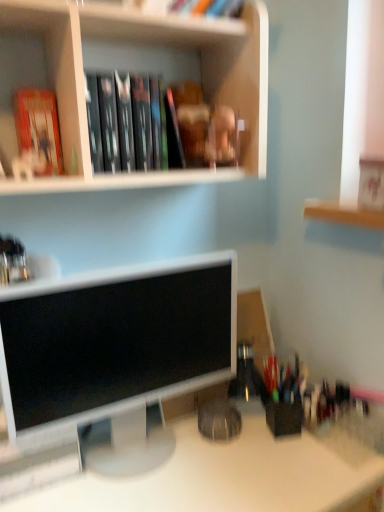
Question: Is hardcover books at upper center smaller than matte white monitor at center?

Choices:
 (A) yes
 (B) no

Answer: (A)

Question: Does hardcover books at upper center appear on the left side of matte white monitor at center?

Choices:
 (A) no
 (B) yes

Answer: (A)

Question: Is hardcover books at upper center positioned before matte white monitor at center?

Choices:
 (A) yes
 (B) no

Answer: (B)

Question: Is hardcover books at upper center outside matte white monitor at center?

Choices:
 (A) yes
 (B) no

Answer: (A)

Question: Is hardcover books at upper center behind matte white monitor at center?

Choices:
 (A) no
 (B) yes

Answer: (B)

Question: From the image's perspective, is hardcover books at upper center above or below matte white monitor at center?

Choices:
 (A) below
 (B) above

Answer: (B)

Question: Does point (122, 114) appear closer or farther from the camera than point (195, 334)?

Choices:
 (A) closer
 (B) farther

Answer: (A)

Question: From their relative heights in the image, would you say hardcover books at upper center is taller or shorter than matte white monitor at center?

Choices:
 (A) tall
 (B) short

Answer: (B)

Question: Do you think hardcover books at upper center is within matte white monitor at center, or outside of it?

Choices:
 (A) outside
 (B) inside

Answer: (A)

Question: From their relative heights in the image, would you say white matte bookshelf at upper center is taller or shorter than matte white monitor at center?

Choices:
 (A) short
 (B) tall

Answer: (A)

Question: Relative to matte white monitor at center, is white matte bookshelf at upper center in front or behind?

Choices:
 (A) behind
 (B) front

Answer: (B)

Question: From a real-world perspective, is white matte bookshelf at upper center above or below matte white monitor at center?

Choices:
 (A) below
 (B) above

Answer: (B)

Question: Based on their sizes in the image, would you say white matte bookshelf at upper center is bigger or smaller than matte white monitor at center?

Choices:
 (A) big
 (B) small

Answer: (A)

Question: Is point (140, 28) positioned closer to the camera than point (140, 168)?

Choices:
 (A) closer
 (B) farther

Answer: (A)

Question: Is white matte bookshelf at upper center wider or thinner than hardcover books at upper center?

Choices:
 (A) wide
 (B) thin

Answer: (A)